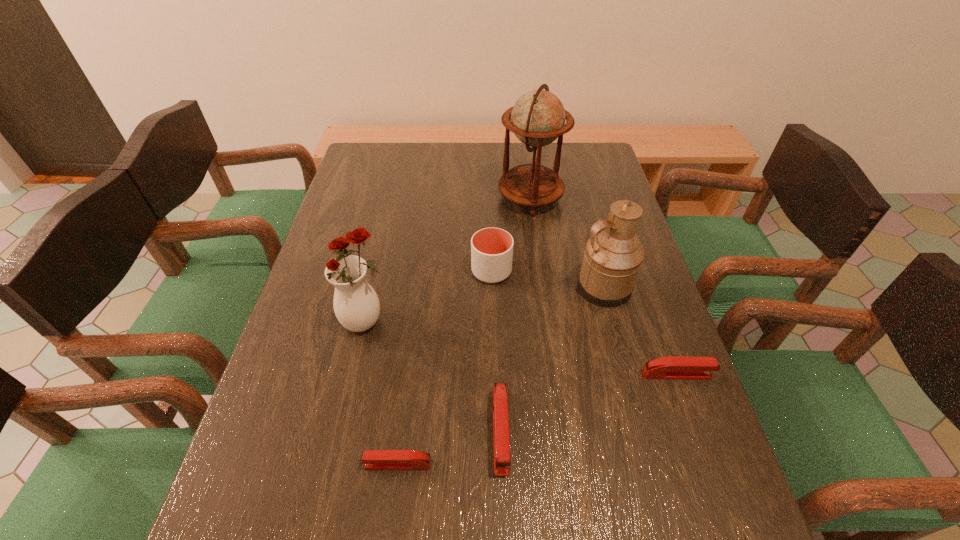
Find the location of a particular element. This screenshot has width=960, height=540. pitcher that is at the right edge is located at coordinates (613, 256).

In the image, there is a desktop. What are the coordinates of `free region at the far edge` in the screenshot? It's located at (560, 165).

Find the location of a particular element. Image resolution: width=960 pixels, height=540 pixels. vacant space at the near edge of the desktop is located at coordinates (374, 478).

The height and width of the screenshot is (540, 960). In order to click on blank space at the left edge of the desktop in this screenshot , I will do `click(289, 376)`.

You are a GUI agent. You are given a task and a screenshot of the screen. Output one action in this format:
    pyautogui.click(x=<x>, y=<y>)
    Task: Click on the free space at the right edge of the desktop
    
    Given the screenshot: What is the action you would take?
    pyautogui.click(x=674, y=430)

Where is `vacant space at the far right corner`? This screenshot has width=960, height=540. vacant space at the far right corner is located at coordinates click(593, 153).

Where is `free area in between the leftmost stapler and the vase`? free area in between the leftmost stapler and the vase is located at coordinates (382, 393).

This screenshot has width=960, height=540. Identify the location of vacant area between the pitcher and the shortest stapler. (501, 376).

Identify the location of vacant area that lies between the rightmost stapler and the second stapler from left to right. This screenshot has width=960, height=540. (588, 403).

Locate an element on the screen. vacant area between the shortest stapler and the vase is located at coordinates (382, 393).